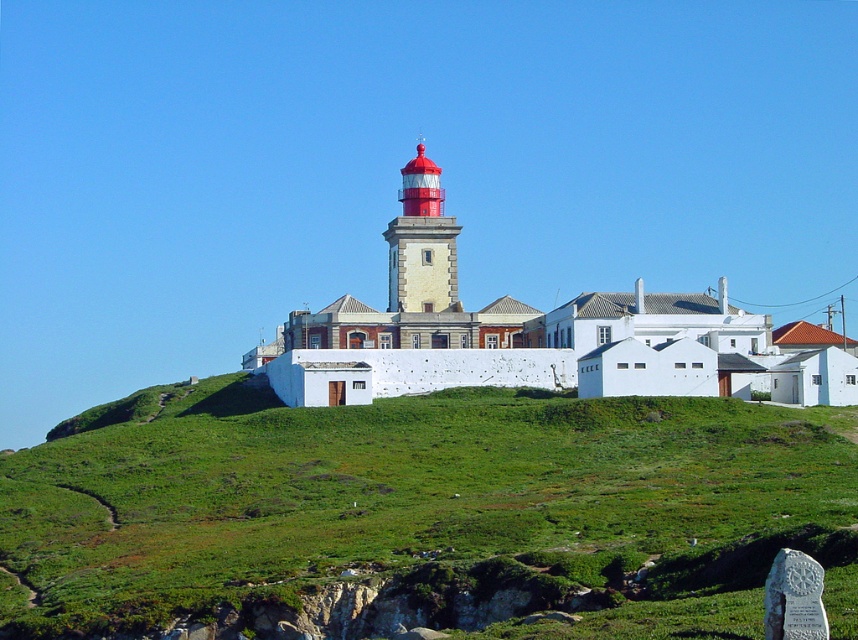
Question: Is green grassy hillside at center thinner than smooth red lighthouse at center?

Choices:
 (A) yes
 (B) no

Answer: (B)

Question: Can you confirm if green grassy hillside at center is smaller than smooth red lighthouse at center?

Choices:
 (A) no
 (B) yes

Answer: (A)

Question: Can you confirm if green grassy hillside at center is wider than smooth red lighthouse at center?

Choices:
 (A) yes
 (B) no

Answer: (A)

Question: Which of the following is the farthest from the observer?

Choices:
 (A) smooth red lighthouse at center
 (B) green grassy hillside at center

Answer: (A)

Question: Among these points, which one is farthest from the camera?

Choices:
 (A) (666, 536)
 (B) (439, 284)

Answer: (B)